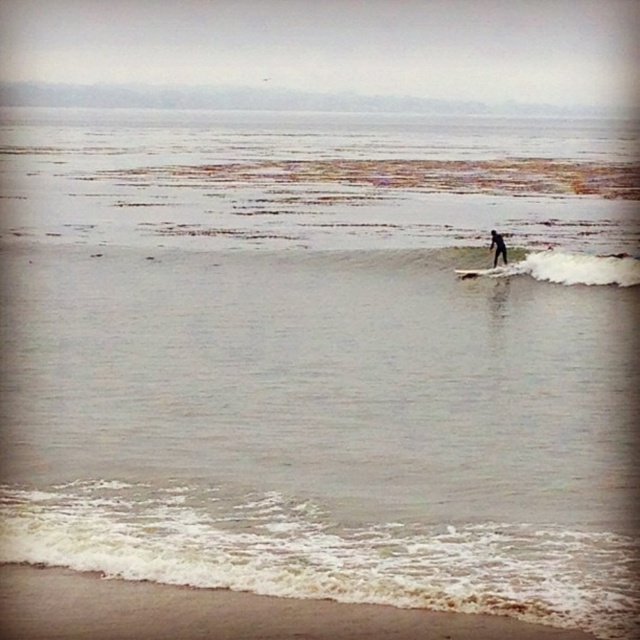
From the picture: You are a beachgoer who wants to rent a surfboard. You see two surfboards in the water, the white foam surfboard at center and the black matte surfboard at center. Which one is wider?

The white foam surfboard at center is wider than the black matte surfboard at center.